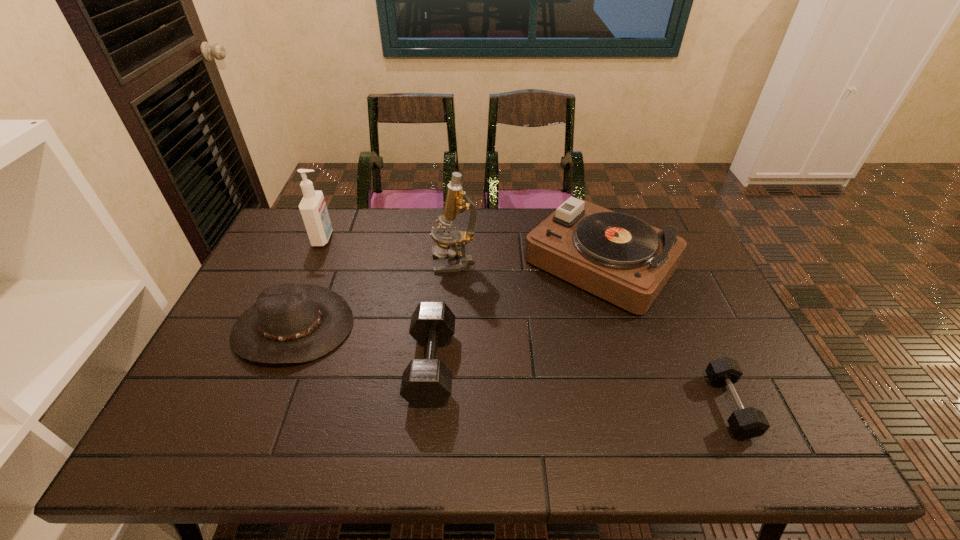
Image resolution: width=960 pixels, height=540 pixels. Find the location of `vacant space situated on the front-facing side of the hat`. vacant space situated on the front-facing side of the hat is located at coordinates coord(259,413).

I want to click on free space located on the right of the left dumbbell, so click(550, 366).

This screenshot has width=960, height=540. I want to click on vacant space located on the left of the shorter dumbbell, so click(x=574, y=405).

Identify the location of microscope that is positioned at the far edge. Image resolution: width=960 pixels, height=540 pixels. (444, 235).

In order to click on cleansing agent at the far edge in this screenshot , I will do `click(313, 209)`.

I want to click on record player located at the far edge, so click(620, 258).

At what (x,y) coordinates should I click in order to perform the action: click on object situated at the near edge. Please return your answer as a coordinate pair (x, y). The width and height of the screenshot is (960, 540). Looking at the image, I should click on (747, 423).

In order to click on cleansing agent that is at the left edge in this screenshot , I will do `click(313, 209)`.

Find the location of a particular element. hat that is at the left edge is located at coordinates (290, 323).

The width and height of the screenshot is (960, 540). In order to click on record player that is at the right edge in this screenshot , I will do `click(620, 258)`.